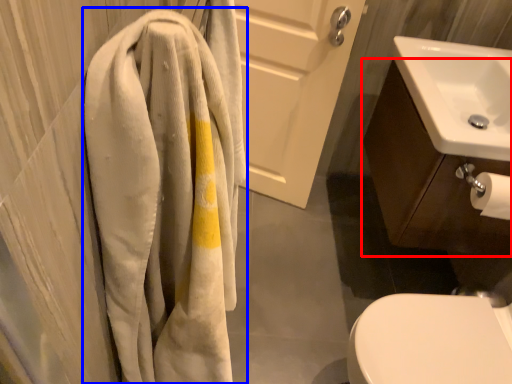
Question: Which object is closer to the camera taking this photo, bathroom cabinet (highlighted by a red box) or towel (highlighted by a blue box)?

Choices:
 (A) bathroom cabinet
 (B) towel

Answer: (B)